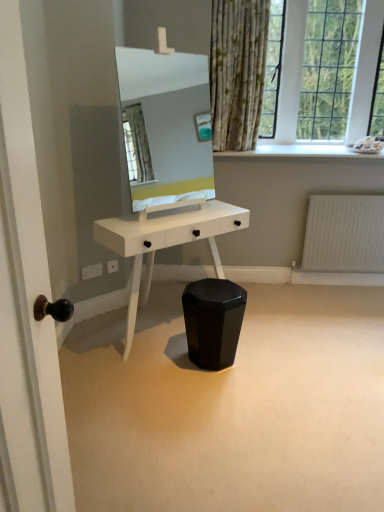
Question: Relative to black glossy stool at center, is white glossy mirror at center in front or behind?

Choices:
 (A) front
 (B) behind

Answer: (A)

Question: Is white glossy mirror at center spatially inside black glossy stool at center, or outside of it?

Choices:
 (A) inside
 (B) outside

Answer: (B)

Question: Considering the real-world distances, which object is closest to the clear glass window at upper right?

Choices:
 (A) white glossy table at center
 (B) black glossy stool at center
 (C) white glossy mirror at center
 (D) white matte radiator at lower right
 (E) wooden door handle on the left

Answer: (D)

Question: Considering the real-world distances, which object is closest to the white glossy mirror at center?

Choices:
 (A) black glossy stool at center
 (B) white glossy table at center
 (C) wooden door handle on the left
 (D) white matte radiator at lower right
 (E) clear glass window at upper right

Answer: (E)